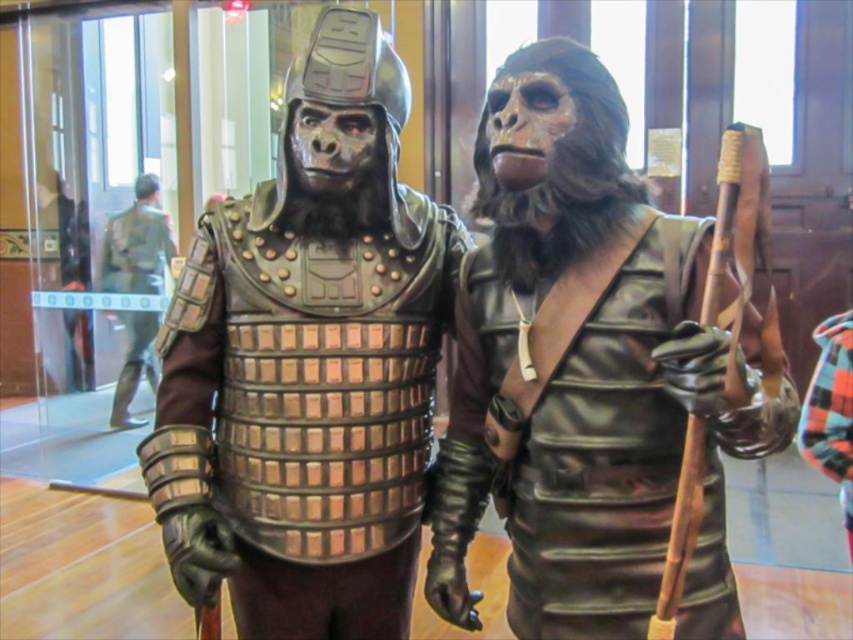
Question: Which point is closer to the camera?

Choices:
 (A) tap(155, 276)
 (B) tap(387, 268)
 (C) tap(579, 588)

Answer: (C)

Question: Is metallic armor at center positioned before brushed metal armor at left?

Choices:
 (A) no
 (B) yes

Answer: (B)

Question: Can you confirm if metallic armor at center is wider than brushed metal armor at left?

Choices:
 (A) yes
 (B) no

Answer: (A)

Question: In this image, where is leather-like armor at center located relative to brushed metal armor at left?

Choices:
 (A) above
 (B) below

Answer: (B)

Question: Which of the following is the farthest from the observer?

Choices:
 (A) leather-like armor at center
 (B) metallic armor at center
 (C) brushed metal armor at left

Answer: (C)

Question: Which of the following is the farthest from the observer?

Choices:
 (A) (767, 419)
 (B) (123, 364)

Answer: (B)